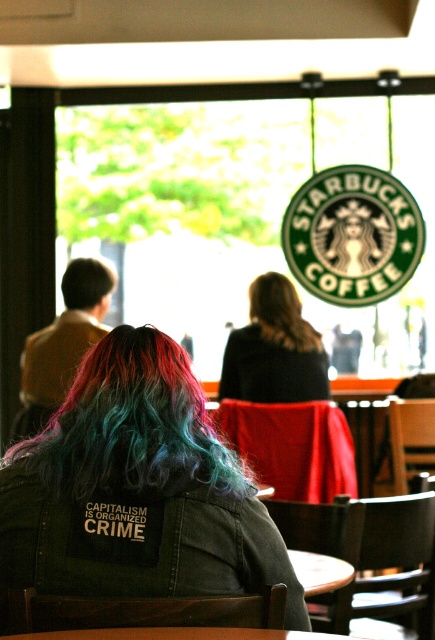
From the picture: You are a barista at Starbucks and need to place a new menu board on the table. The menu board is the same size as the denim jacket at center. Will the menu board fit on the wooden table at center?

The denim jacket at center has a larger size compared to the wooden table at center. Since the menu board is the same size as the denim jacket at center, it will not fit on the wooden table at center.

You are a barista at Starbucks and need to place two jackets on a hanger. The denim jacket at center and the black matte jacket at center are both on the floor. Which jacket should you pick up first if you want to hang the taller one first?

The denim jacket at center is taller than the black matte jacket at center, so you should pick up the denim jacket at center first to hang it before the other.

You are a barista working at the Starbucks coffee shop. You need to place a new menu board between the denim jacket at center and the black matte jacket at center. The menu board is 1.5 meters wide. Is there enough space between them to fit the menu board?

The denim jacket at center is 2.06 meters from the black matte jacket at center. Since the menu board is 1.5 meters wide, there is enough space between the denim jacket at center and the black matte jacket at center to fit the menu board.